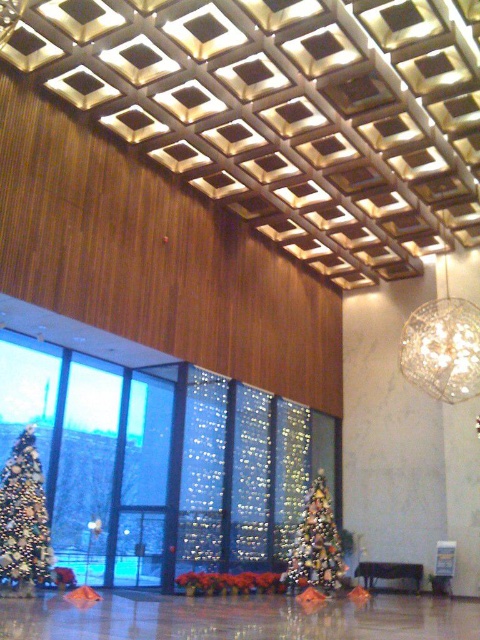
Question: Which point is closer to the camera taking this photo?

Choices:
 (A) (314, 504)
 (B) (33, 504)

Answer: (B)

Question: Which of the following is the closest to the observer?

Choices:
 (A) (24, 429)
 (B) (327, 534)

Answer: (A)

Question: Among these points, which one is nearest to the camera?

Choices:
 (A) (20, 513)
 (B) (303, 538)

Answer: (A)

Question: Is shiny gold christmas tree at left below shiny gold christmas tree at center?

Choices:
 (A) no
 (B) yes

Answer: (A)

Question: Can you confirm if shiny gold christmas tree at left is positioned above shiny gold christmas tree at center?

Choices:
 (A) yes
 (B) no

Answer: (A)

Question: Observing the image, what is the correct spatial positioning of shiny gold christmas tree at left in reference to shiny gold christmas tree at center?

Choices:
 (A) below
 (B) above

Answer: (B)